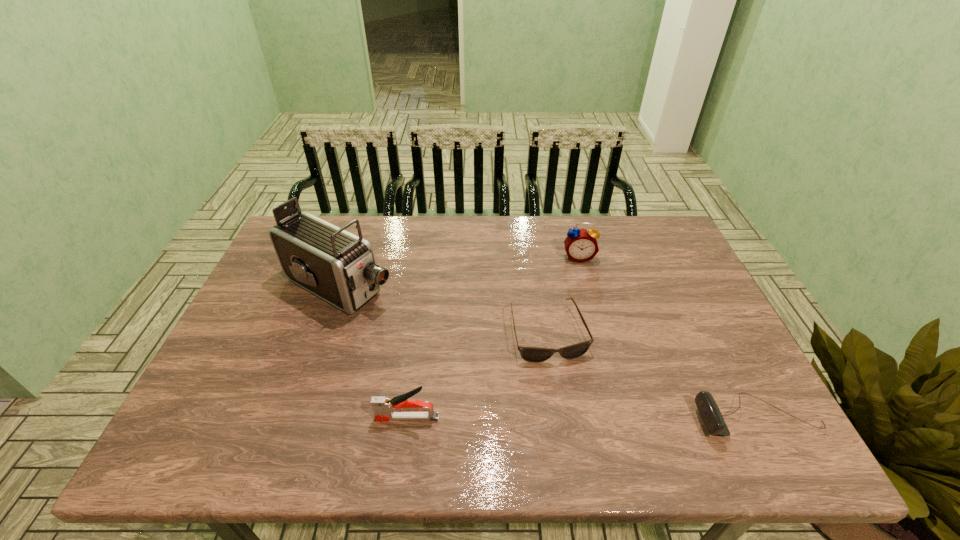
Find the location of a particular element. empty space that is in between the leftmost object and the shortest object is located at coordinates [444, 309].

The image size is (960, 540). Identify the location of empty space that is in between the camcorder and the sunglasses. (444, 309).

The width and height of the screenshot is (960, 540). I want to click on free space that is in between the stapler and the alarm clock, so click(x=492, y=338).

Identify the location of free space between the fourth object from right to left and the webcam. The height and width of the screenshot is (540, 960). (583, 417).

Find the location of a particular element. Image resolution: width=960 pixels, height=540 pixels. unoccupied position between the camcorder and the second tallest object is located at coordinates (459, 272).

I want to click on object that is the closest to the rightmost object, so point(530,354).

Identify the location of object that is the second closest to the sunglasses. The height and width of the screenshot is (540, 960). (709, 412).

Where is `vacant region that satisfies the following two spatial constraints: 1. on the front side of the second object from left to right; 2. on the handle side of the leftmost object`? The height and width of the screenshot is (540, 960). vacant region that satisfies the following two spatial constraints: 1. on the front side of the second object from left to right; 2. on the handle side of the leftmost object is located at coordinates (295, 417).

Where is `vacant area that satisfies the following two spatial constraints: 1. on the front side of the webcam; 2. on the front-facing side of the second tallest object`? The height and width of the screenshot is (540, 960). vacant area that satisfies the following two spatial constraints: 1. on the front side of the webcam; 2. on the front-facing side of the second tallest object is located at coordinates (620, 417).

You are a GUI agent. You are given a task and a screenshot of the screen. Output one action in this format:
    pyautogui.click(x=<x>, y=<y>)
    Task: Click on the free location that satisfies the following two spatial constraints: 1. on the back side of the tallest object; 2. on the left side of the alarm clock
    Image resolution: width=960 pixels, height=540 pixels.
    Given the screenshot: What is the action you would take?
    pyautogui.click(x=350, y=257)